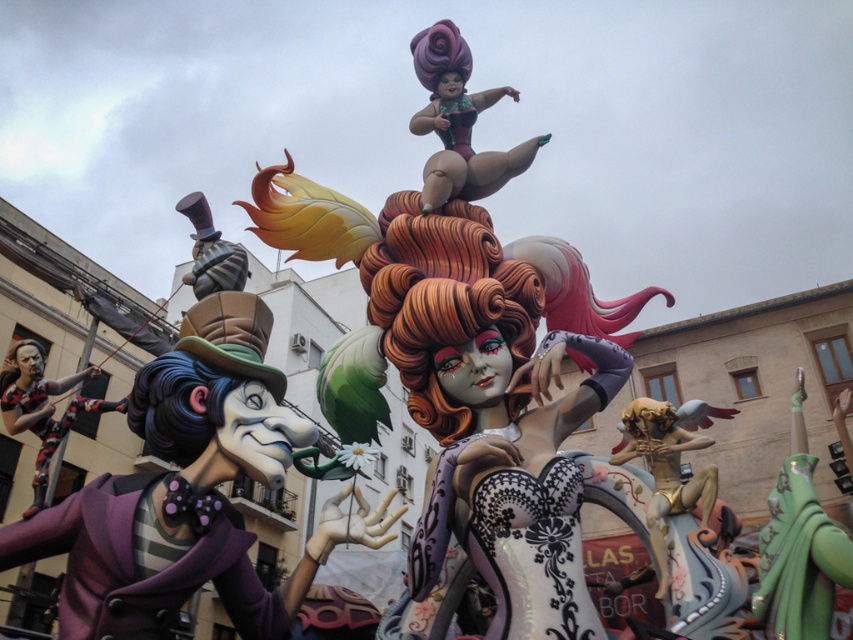
Question: Does matte purple suit at left come behind purple matte doll at upper center?

Choices:
 (A) yes
 (B) no

Answer: (B)

Question: Is matte purple suit at left wider than shiny silver top hat at upper left?

Choices:
 (A) no
 (B) yes

Answer: (B)

Question: Which object is positioned farthest from the black matte figure at left?

Choices:
 (A) matte purple suit at left
 (B) shiny silver top hat at upper left

Answer: (B)

Question: Estimate the real-world distances between objects in this image. Which object is farther from the matte purple suit at left?

Choices:
 (A) purple matte doll at upper center
 (B) shiny silver top hat at upper left
 (C) black matte figure at left

Answer: (A)

Question: Does matte purple suit at left appear on the right side of shiny silver top hat at upper left?

Choices:
 (A) yes
 (B) no

Answer: (A)

Question: Which point is closer to the camera?

Choices:
 (A) matte purple suit at left
 (B) green fabric doll at center
 (C) purple matte doll at upper center
 (D) shiny silver top hat at upper left

Answer: (B)